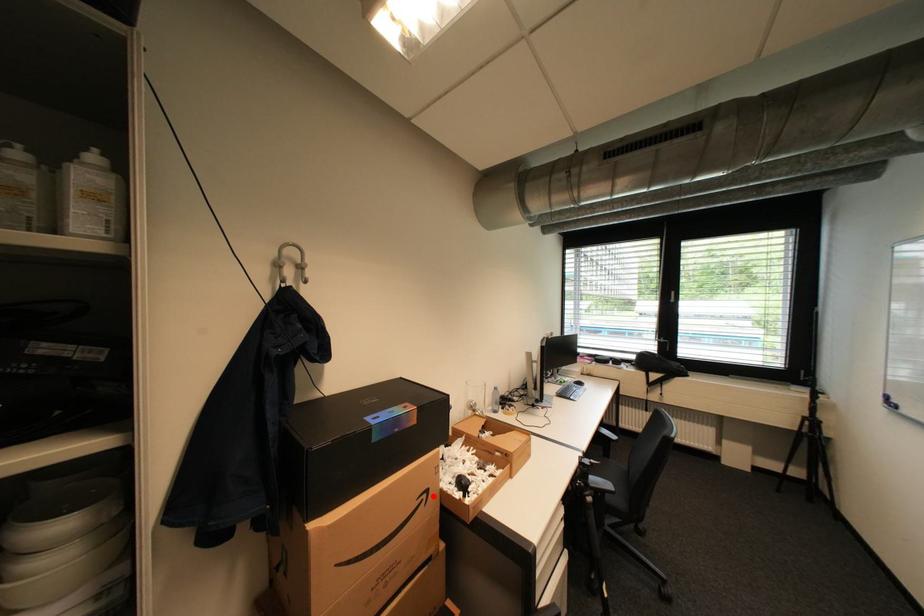
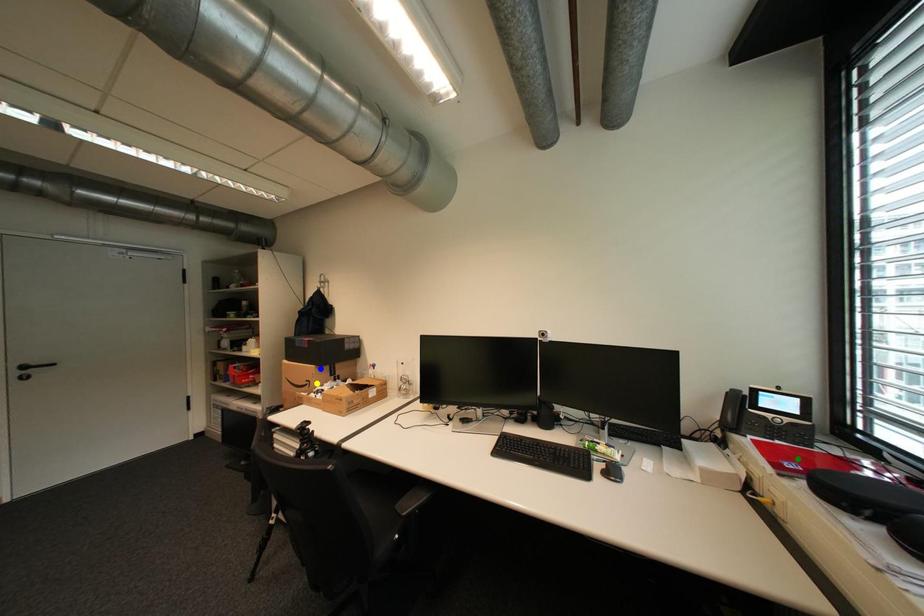
Question: I am providing you with two images of the same scene from different viewpoints. A red point is marked on the first image. You are given multiple points on the second image. Which point in image 2 is actually the same real-world point as the red point in image 1?

Choices:
 (A) blue point
 (B) yellow point
 (C) green point

Answer: (B)